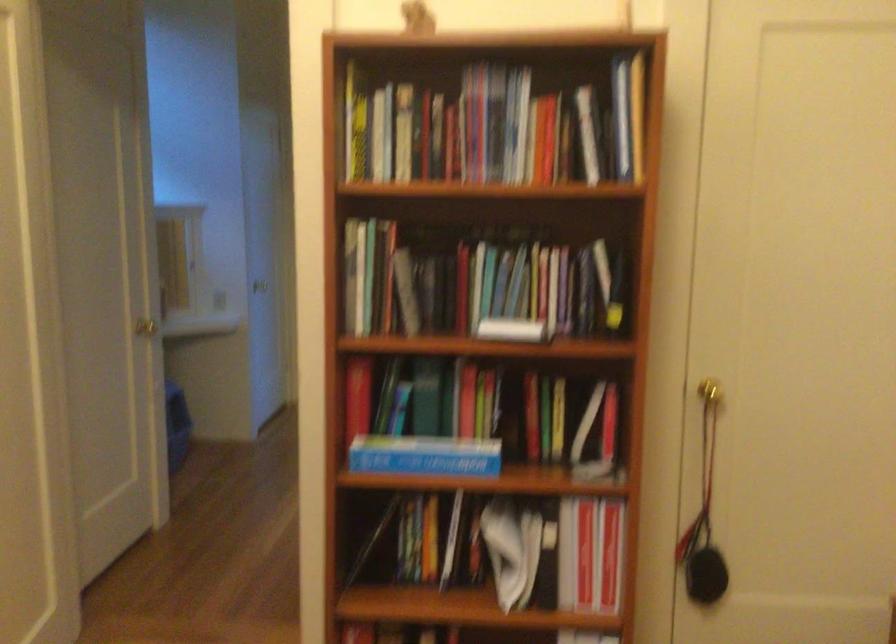
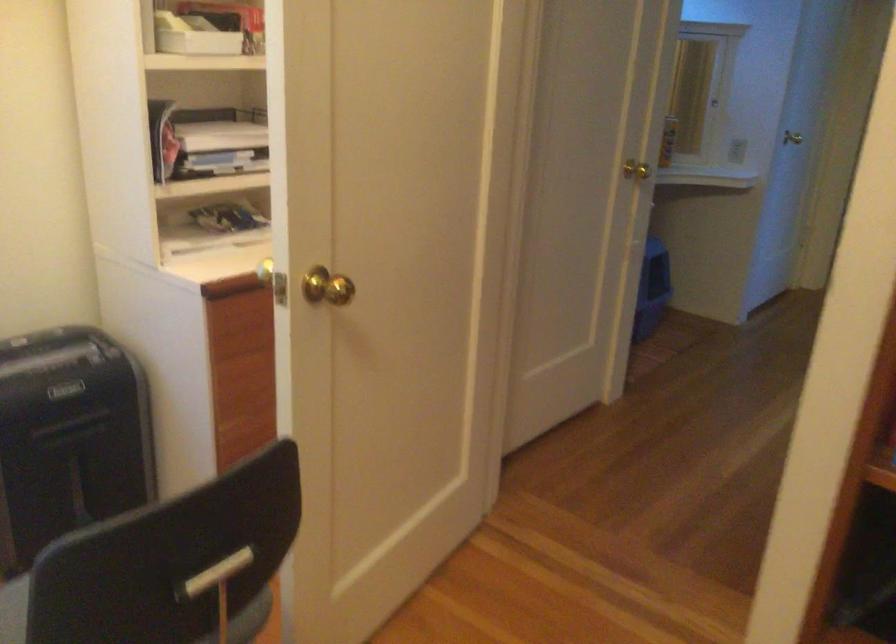
Question: The images are taken continuously from a first-person perspective. In which direction is your viewpoint rotating?

Choices:
 (A) Left
 (B) Right
 (C) Up
 (D) Down

Answer: (A)